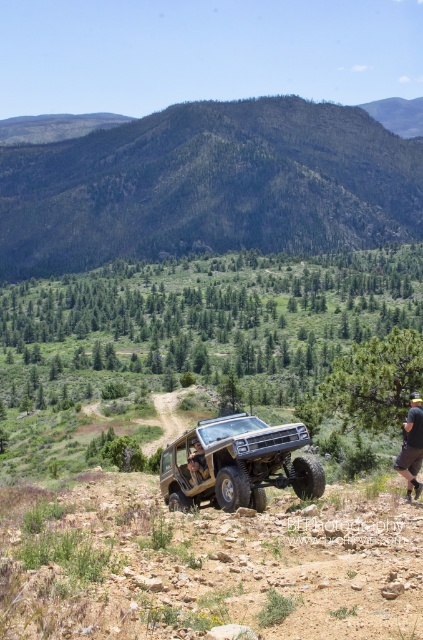
Question: Among these objects, which one is farthest from the camera?

Choices:
 (A) green textured mountain at upper center
 (B) brown leather jacket at center

Answer: (A)

Question: Is matte khaki jeep at center smaller than khaki shorts at lower right?

Choices:
 (A) yes
 (B) no

Answer: (B)

Question: Which is nearer to the khaki shorts at lower right?

Choices:
 (A) matte khaki jeep at center
 (B) green textured mountain at upper center
 (C) brown leather jacket at center

Answer: (A)

Question: Which of the following is the farthest from the observer?

Choices:
 (A) matte khaki jeep at center
 (B) green textured mountain at upper center
 (C) brown leather jacket at center

Answer: (B)

Question: Is matte khaki jeep at center wider than brown leather jacket at center?

Choices:
 (A) yes
 (B) no

Answer: (A)

Question: Can you confirm if matte khaki jeep at center is thinner than khaki shorts at lower right?

Choices:
 (A) no
 (B) yes

Answer: (A)